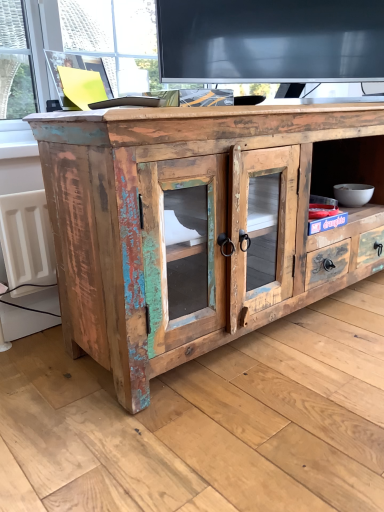
Question: Is white plastic radiator at left outside distressed wood cabinet at center?

Choices:
 (A) yes
 (B) no

Answer: (A)

Question: Does white plastic radiator at left turn towards distressed wood cabinet at center?

Choices:
 (A) no
 (B) yes

Answer: (A)

Question: Is white plastic radiator at left to the left of distressed wood cabinet at center from the viewer's perspective?

Choices:
 (A) no
 (B) yes

Answer: (B)

Question: From a real-world perspective, is white plastic radiator at left located higher than distressed wood cabinet at center?

Choices:
 (A) no
 (B) yes

Answer: (A)

Question: Is white plastic radiator at left bigger than distressed wood cabinet at center?

Choices:
 (A) no
 (B) yes

Answer: (A)

Question: Can you confirm if white plastic radiator at left is smaller than distressed wood cabinet at center?

Choices:
 (A) no
 (B) yes

Answer: (B)

Question: Are distressed wood cabinet at center and white plastic radiator at left making contact?

Choices:
 (A) yes
 (B) no

Answer: (B)

Question: Can you confirm if distressed wood cabinet at center is thinner than white plastic radiator at left?

Choices:
 (A) yes
 (B) no

Answer: (B)

Question: Does distressed wood cabinet at center lie in front of white plastic radiator at left?

Choices:
 (A) no
 (B) yes

Answer: (B)

Question: From a real-world perspective, is distressed wood cabinet at center on top of white plastic radiator at left?

Choices:
 (A) no
 (B) yes

Answer: (B)

Question: Is distressed wood cabinet at center oriented towards white plastic radiator at left?

Choices:
 (A) yes
 (B) no

Answer: (B)

Question: Does distressed wood cabinet at center have a larger size compared to white plastic radiator at left?

Choices:
 (A) no
 (B) yes

Answer: (B)

Question: Considering the relative positions of distressed wood cabinet at center and white plastic radiator at left in the image provided, is distressed wood cabinet at center to the left or to the right of white plastic radiator at left?

Choices:
 (A) left
 (B) right

Answer: (B)